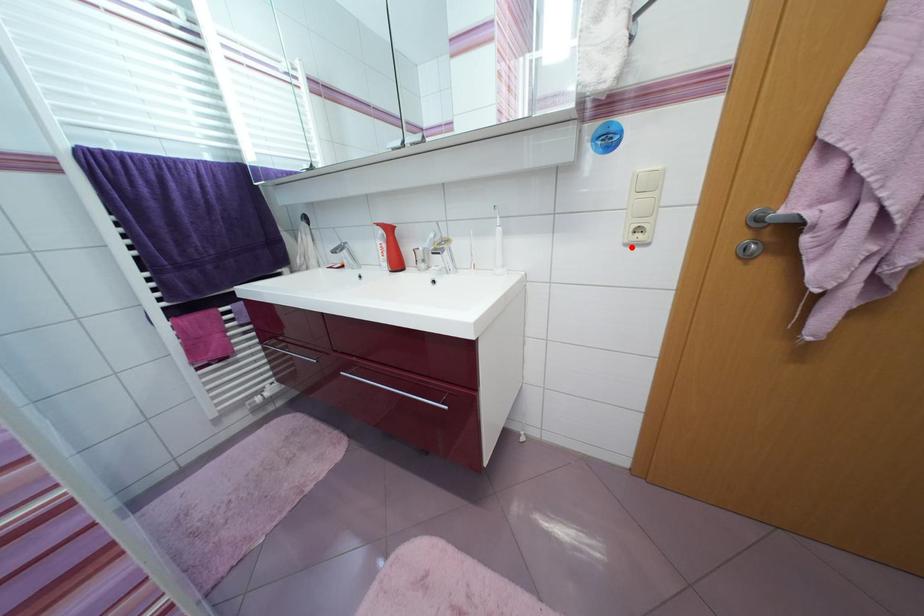
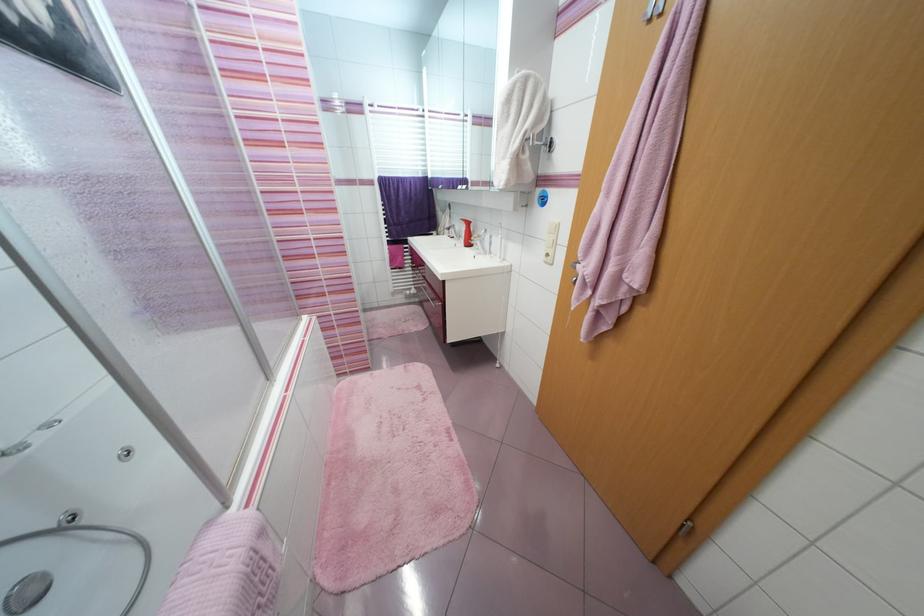
Where in the second image is the point corresponding to the highlighted location from the first image?

(551, 264)